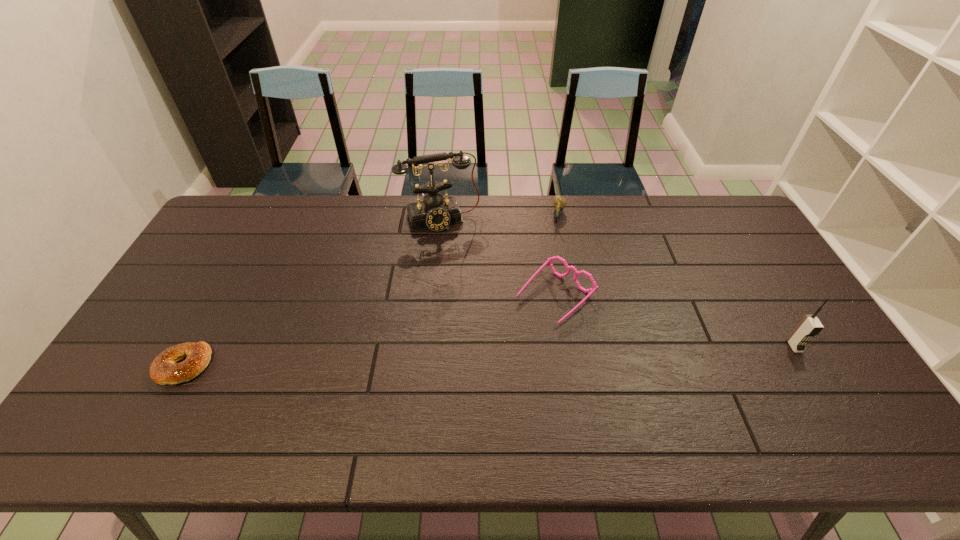
The height and width of the screenshot is (540, 960). In order to click on blank space at the far right corner in this screenshot , I will do `click(706, 219)`.

The width and height of the screenshot is (960, 540). I want to click on free space between the shortest object and the third farthest object, so click(370, 331).

You are a GUI agent. You are given a task and a screenshot of the screen. Output one action in this format:
    pyautogui.click(x=<x>, y=<y>)
    Task: Click on the vacant space in between the third farthest object and the second tallest object
    The height and width of the screenshot is (540, 960).
    Given the screenshot: What is the action you would take?
    pyautogui.click(x=675, y=321)

The image size is (960, 540). What are the coordinates of `free space between the tallest object and the escargot` in the screenshot? It's located at (499, 218).

What are the coordinates of `free space between the fourth shortest object and the tallest object` in the screenshot? It's located at (617, 283).

Locate an element on the screen. The width and height of the screenshot is (960, 540). vacant area that lies between the cellular telephone and the escargot is located at coordinates (677, 281).

The width and height of the screenshot is (960, 540). In order to click on free space that is in between the leftmost object and the fourth object from right to left in this screenshot , I will do `click(312, 293)`.

At what (x,y) coordinates should I click in order to perform the action: click on empty space between the fourth tallest object and the bagel. Please return your answer as a coordinate pair (x, y). This screenshot has height=540, width=960. Looking at the image, I should click on (372, 291).

Image resolution: width=960 pixels, height=540 pixels. I want to click on vacant area that lies between the second shortest object and the third farthest object, so click(x=557, y=256).

Where is `free spot between the rightmost object and the third nearest object`? The height and width of the screenshot is (540, 960). free spot between the rightmost object and the third nearest object is located at coordinates (675, 321).